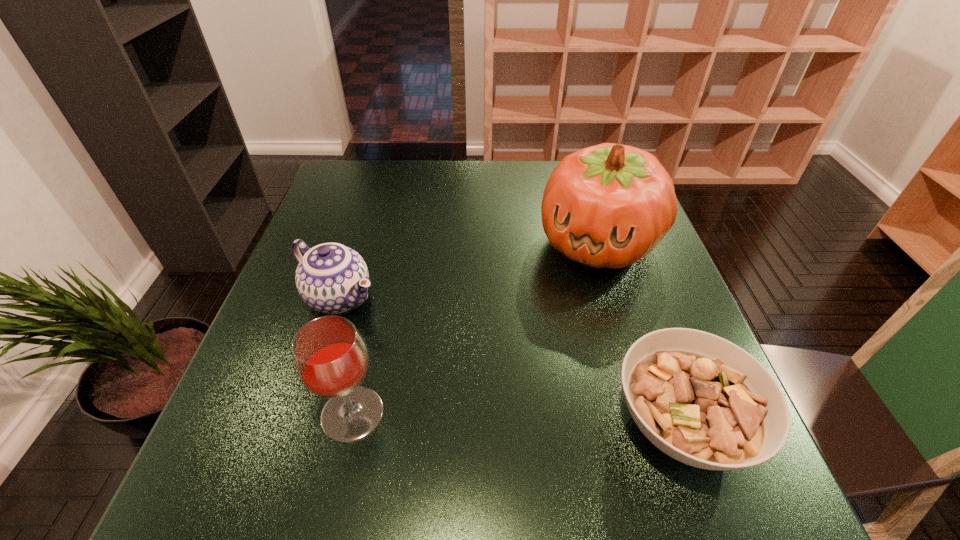
Where is `free space on the desktop that is between the third shortest object and the stew and is positioned at the spout of the third tallest object`? free space on the desktop that is between the third shortest object and the stew and is positioned at the spout of the third tallest object is located at coordinates (525, 418).

The image size is (960, 540). What are the coordinates of `vacant space on the desktop that is between the third shortest object and the stew and is positioned on the side of the pumpkin with the cute face` in the screenshot? It's located at (503, 418).